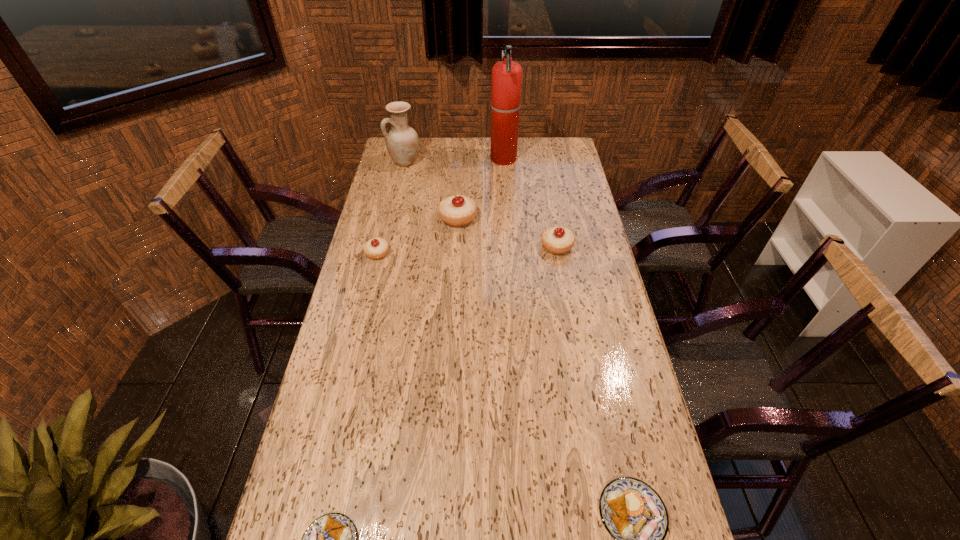
Image resolution: width=960 pixels, height=540 pixels. Identify the location of red fire extinguisher. click(x=506, y=75).

You are a GUI agent. You are given a task and a screenshot of the screen. Output one action in this format:
    pyautogui.click(x=<x>, y=<y>)
    Task: Click on the third object from right to left
    The width and height of the screenshot is (960, 540).
    Given the screenshot: What is the action you would take?
    pyautogui.click(x=506, y=75)

The width and height of the screenshot is (960, 540). Find the location of `pink pottery`. pink pottery is located at coordinates (402, 142).

I want to click on the second tallest object, so click(402, 142).

The width and height of the screenshot is (960, 540). Identify the location of the second beige pastry from right to left. (456, 210).

At what (x,y) coordinates should I click in order to perform the action: click on the third pastry from right to left. Please return your answer as a coordinate pair (x, y). Looking at the image, I should click on (456, 210).

The image size is (960, 540). What are the coordinates of `the rightmost beige pastry` in the screenshot? It's located at pos(557,240).

Where is `the second biggest beige pastry`? Image resolution: width=960 pixels, height=540 pixels. the second biggest beige pastry is located at coordinates tap(557, 240).

I want to click on the third shortest object, so click(x=376, y=248).

Find the location of `the smallest beige pastry`. the smallest beige pastry is located at coordinates (376, 248).